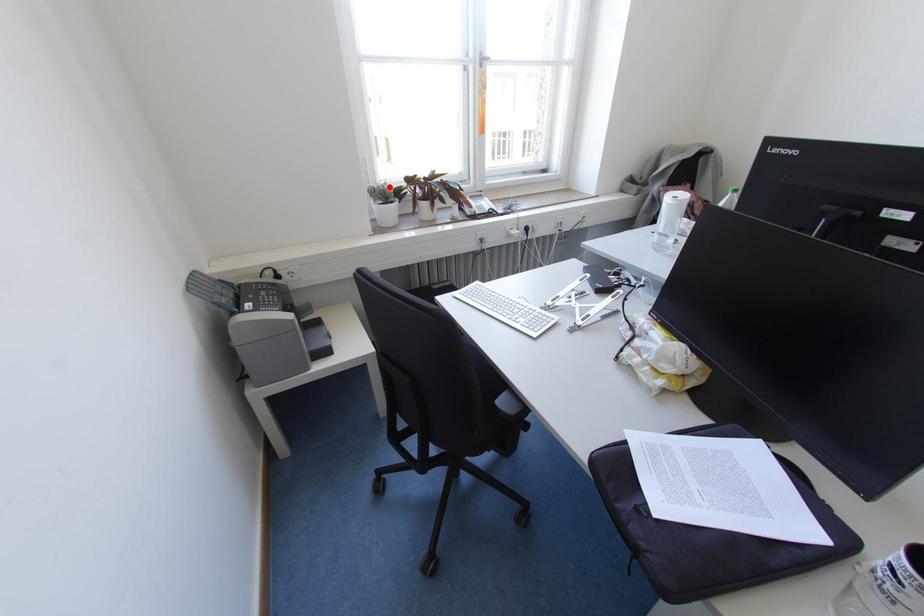
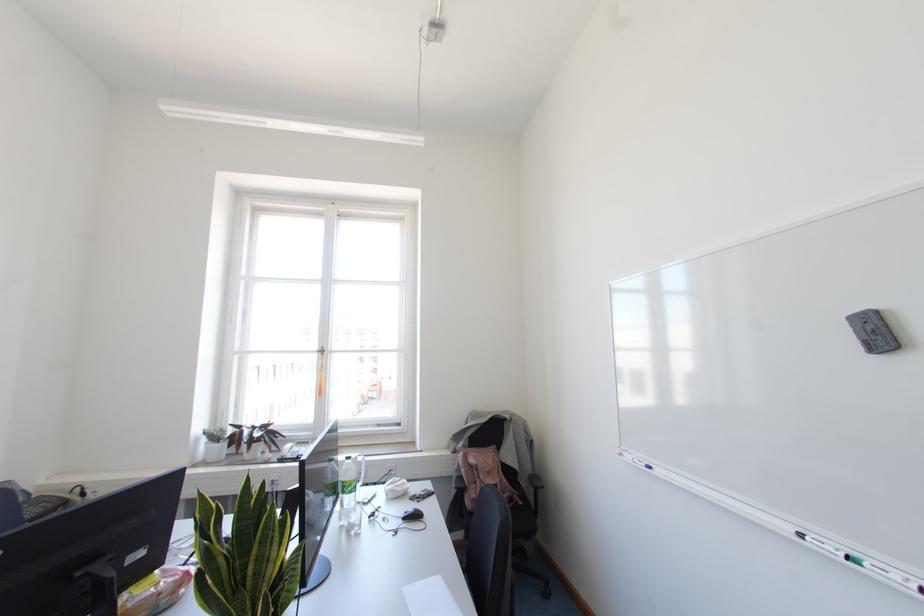
Question: I am providing you with two images of the same scene from different viewpoints. A red point is shown in image1. For the corresponding object point in image2, is it positioned nearer or farther from the camera?

Choices:
 (A) Nearer
 (B) Farther

Answer: (B)